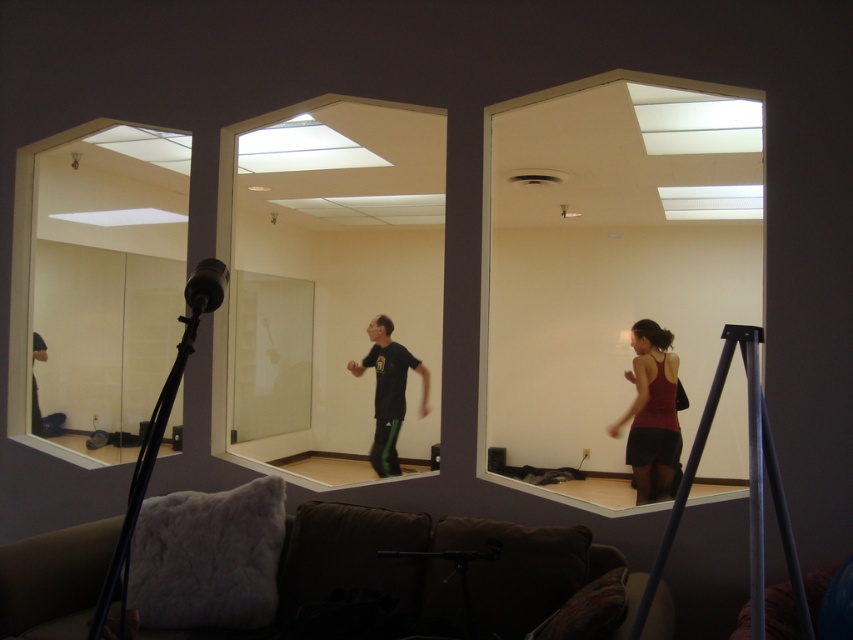
You are setting up a photography studio and need to place a 1.8m tall backdrop stand between the clear glass mirror at left and the metallic tripod at right. Based on their heights, will the backdrop stand fit between them without touching either object?

The clear glass mirror at left is taller than the metallic tripod at right. Since the backdrop stand is 1.8m tall, it may not fit between them if the space between the two objects is constrained by their heights. However, the exact placement depends on the horizontal distance between them, which isn

You are a stage designer planning to place a 5 meter long decorative banner between the clear glass mirror at center and the black matte tripod at lower left. Based on the scene, will the banner fit without overlapping either object?

The distance between the clear glass mirror at center and the black matte tripod at lower left is 6.29 meters. Since the banner is 5 meters long, it will fit within the space without overlapping either object.

You are standing in a room with a clear glass mirror at center. If you want to touch the mirror without moving your feet, what is the maximum distance you can reach towards it?

The clear glass mirror at center is 7.81 meters away, so you can reach up to approximately 2 meters, which is much closer than the mirror. Therefore, you cannot reach it without moving your feet.